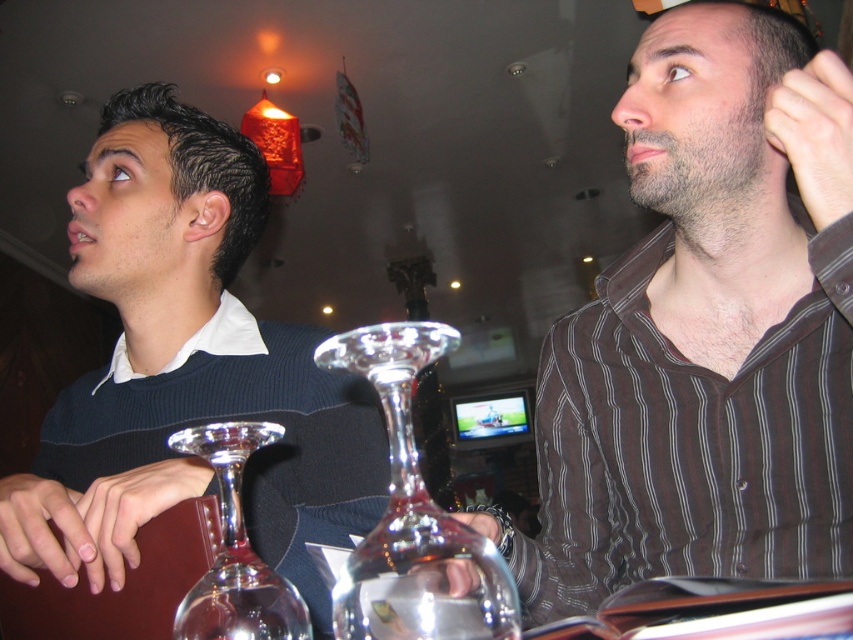
Question: Is matte black sweater at left wider than transparent glass wine glass at center?

Choices:
 (A) yes
 (B) no

Answer: (A)

Question: Can you confirm if matte black sweater at left is smaller than clear glass wine glass at center?

Choices:
 (A) no
 (B) yes

Answer: (A)

Question: Which of these objects is positioned closest to the matte black sweater at left?

Choices:
 (A) clear glass wine glass at center
 (B) transparent glass wine glass at center
 (C) brown striped shirt at upper right

Answer: (A)

Question: Which point is farther to the camera?

Choices:
 (A) transparent glass wine glass at center
 (B) brown striped shirt at upper right

Answer: (B)

Question: Is clear glass wine glass at center below transparent glass wine glass at center?

Choices:
 (A) no
 (B) yes

Answer: (A)

Question: Which object is positioned closest to the transparent glass wine glass at center?

Choices:
 (A) matte black sweater at left
 (B) clear glass wine glass at center

Answer: (B)